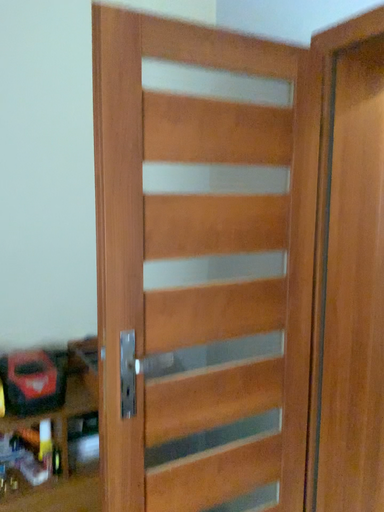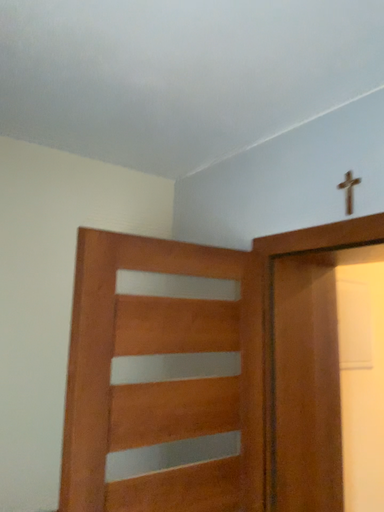
Question: How did the camera likely rotate when shooting the video?

Choices:
 (A) rotated left
 (B) rotated right

Answer: (B)